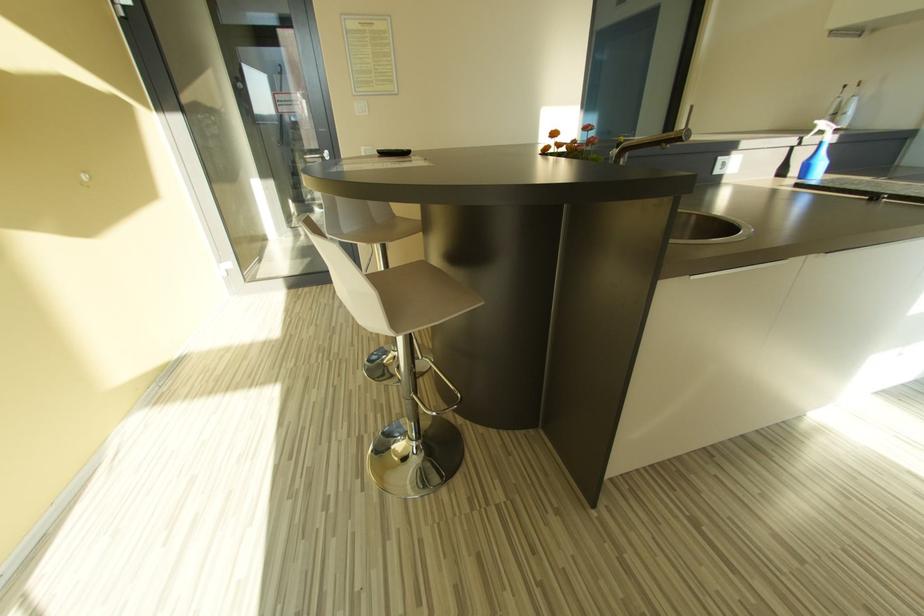
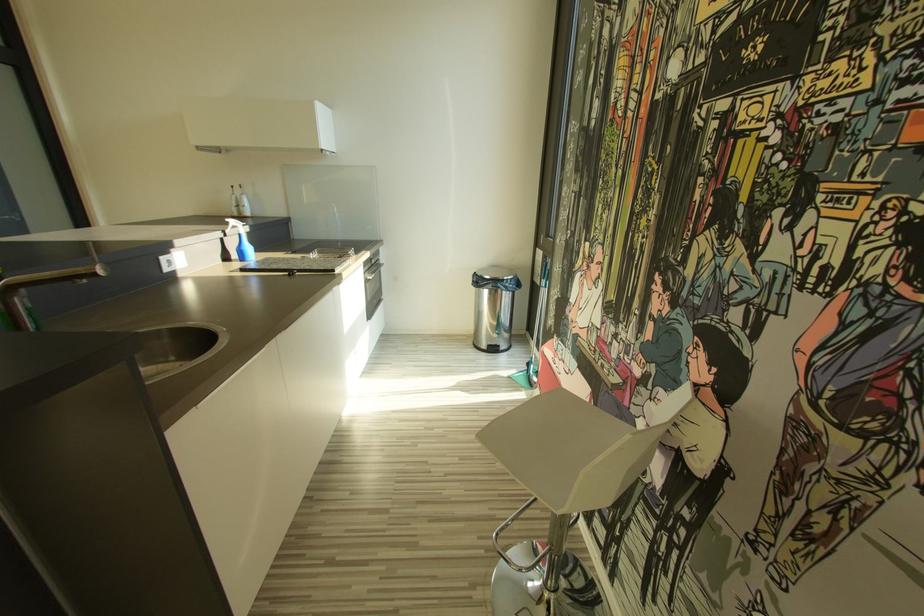
Question: The images are taken continuously from a first-person perspective. In which direction is your viewpoint rotating?

Choices:
 (A) Left
 (B) Right
 (C) Up
 (D) Down

Answer: (B)